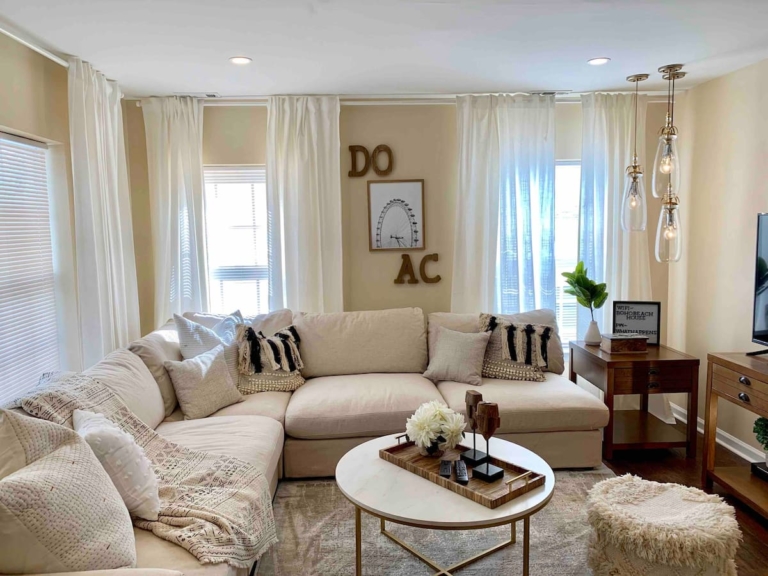
Find the location of a particular element. ottoman is located at coordinates (667, 540).